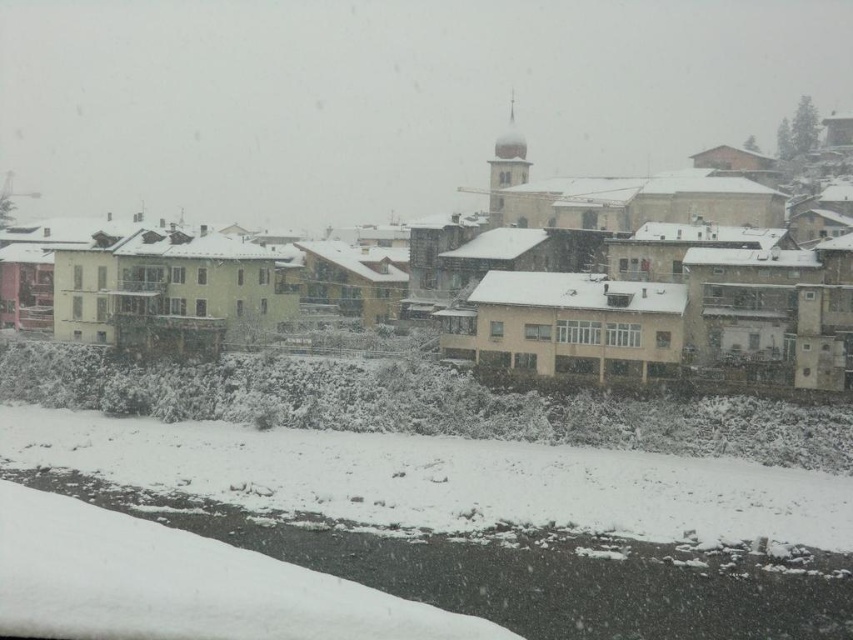
Question: Which point is farther to the camera?

Choices:
 (A) tap(734, 524)
 (B) tap(230, 323)

Answer: (B)

Question: Is white fluffy snow at lower center smaller than matte yellow building at center?

Choices:
 (A) yes
 (B) no

Answer: (A)

Question: Is white fluffy snow at lower center thinner than matte yellow building at center?

Choices:
 (A) no
 (B) yes

Answer: (B)

Question: Is white fluffy snow at lower center bigger than matte yellow building at center?

Choices:
 (A) no
 (B) yes

Answer: (A)